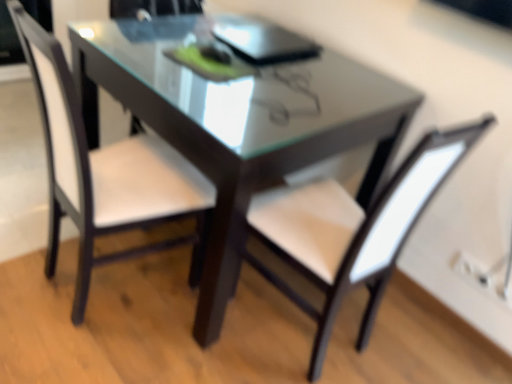
What do you see at coordinates (239, 125) in the screenshot?
I see `transparent glass table at center` at bounding box center [239, 125].

Identify the location of transparent glass table at center. The image size is (512, 384). (239, 125).

Between transparent glass table at center and white leather chair at center, marked as the first chair in a right-to-left arrangement, which one is positioned in front?

white leather chair at center, marked as the first chair in a right-to-left arrangement, is closer to the camera.

Based on the photo, is transparent glass table at center not within white leather chair at center, marked as the first chair in a right-to-left arrangement?

Indeed, transparent glass table at center is completely outside white leather chair at center, marked as the first chair in a right-to-left arrangement.

In terms of width, does transparent glass table at center look wider or thinner when compared to white leather chair at center, marked as the first chair in a right-to-left arrangement?

In the image, transparent glass table at center appears to be wider than white leather chair at center, marked as the first chair in a right-to-left arrangement.

From a real-world perspective, who is located lower, transparent glass table at center or white leather chair at center, marked as the first chair in a right-to-left arrangement?

transparent glass table at center is physically lower.

Is white leather chair at center, marked as the first chair in a right-to-left arrangement, beside transparent glass table at center?

No, white leather chair at center, marked as the first chair in a right-to-left arrangement, is not touching transparent glass table at center.

In the scene shown: Is white leather chair at center, marked as the 2th chair in a left-to-right arrangement, bigger or smaller than transparent glass table at center?

Clearly, white leather chair at center, marked as the 2th chair in a left-to-right arrangement, is smaller in size than transparent glass table at center.

Is point (390, 231) closer to camera compared to point (271, 176)?

No, (390, 231) is behind (271, 176).

How many degrees apart are the facing directions of white leather chair at center, marked as the first chair in a right-to-left arrangement, and transparent glass table at center?

The angle between the facing direction of white leather chair at center, marked as the first chair in a right-to-left arrangement, and the facing direction of transparent glass table at center is 97.2 degrees.

Could you tell me if transparent glass table at center is facing white leather chair at center, the second chair from the right?

Yes, transparent glass table at center faces towards white leather chair at center, the second chair from the right.

Relative to white leather chair at center, the second chair from the right, is transparent glass table at center in front or behind?

Clearly, transparent glass table at center is behind white leather chair at center, the second chair from the right.

In the scene shown: Is transparent glass table at center spatially inside white leather chair at center, marked as the 1th chair in a left-to-right arrangement, or outside of it?

The correct answer is: outside.

Can you confirm if transparent glass table at center is smaller than white leather chair at center, marked as the 1th chair in a left-to-right arrangement?

No, transparent glass table at center is not smaller than white leather chair at center, marked as the 1th chair in a left-to-right arrangement.

In the scene shown: Is white leather chair at center, marked as the 1th chair in a left-to-right arrangement, in front of white leather chair at center, marked as the 2th chair in a left-to-right arrangement?

No, it is not.

Locate an element on the screen. chair above the white leather chair at center, marked as the first chair in a right-to-left arrangement (from a real-world perspective) is located at coordinates (105, 172).

Does white leather chair at center, the second chair from the right, appear on the right side of white leather chair at center, marked as the 2th chair in a left-to-right arrangement?

In fact, white leather chair at center, the second chair from the right, is to the left of white leather chair at center, marked as the 2th chair in a left-to-right arrangement.

Measure the distance from white leather chair at center, the second chair from the right, to white leather chair at center, marked as the 2th chair in a left-to-right arrangement.

A distance of 18.55 inches exists between white leather chair at center, the second chair from the right, and white leather chair at center, marked as the 2th chair in a left-to-right arrangement.

Based on their sizes in the image, would you say white leather chair at center, marked as the first chair in a right-to-left arrangement, is bigger or smaller than white leather chair at center, the second chair from the right?

In the image, white leather chair at center, marked as the first chair in a right-to-left arrangement, appears to be larger than white leather chair at center, the second chair from the right.

Does point (289, 294) appear closer or farther from the camera than point (32, 40)?

Point (289, 294).

From a real-world perspective, relative to white leather chair at center, marked as the 1th chair in a left-to-right arrangement, is white leather chair at center, marked as the first chair in a right-to-left arrangement, vertically above or below?

From a real-world perspective, white leather chair at center, marked as the first chair in a right-to-left arrangement, is physically below white leather chair at center, marked as the 1th chair in a left-to-right arrangement.

Can you tell me how much white leather chair at center, marked as the first chair in a right-to-left arrangement, and white leather chair at center, marked as the 1th chair in a left-to-right arrangement, differ in facing direction?

The angle between the facing direction of white leather chair at center, marked as the first chair in a right-to-left arrangement, and the facing direction of white leather chair at center, marked as the 1th chair in a left-to-right arrangement, is 85.9 degrees.

From the picture: Is transparent glass table at center at the back of white leather chair at center, marked as the 1th chair in a left-to-right arrangement?

Correct, white leather chair at center, marked as the 1th chair in a left-to-right arrangement, is looking away from transparent glass table at center.

In the image, is white leather chair at center, marked as the 1th chair in a left-to-right arrangement, on the left side or the right side of transparent glass table at center?

Clearly, white leather chair at center, marked as the 1th chair in a left-to-right arrangement, is on the left of transparent glass table at center in the image.

Considering the sizes of objects white leather chair at center, the second chair from the right, and transparent glass table at center in the image provided, who is smaller, white leather chair at center, the second chair from the right, or transparent glass table at center?

white leather chair at center, the second chair from the right, is smaller.

Is the position of white leather chair at center, marked as the 1th chair in a left-to-right arrangement, less distant than that of transparent glass table at center?

Yes, white leather chair at center, marked as the 1th chair in a left-to-right arrangement, is in front of transparent glass table at center.

From the image's perspective, count 2nd chairs downward from the transparent glass table at center and point to it. Please provide its 2D coordinates.

[(351, 230)]

The height and width of the screenshot is (384, 512). In order to click on the 2nd chair in front of the transparent glass table at center, starting your count from the anchor in this screenshot , I will do `click(351, 230)`.

Looking at the image, which one is located further to transparent glass table at center, white leather chair at center, marked as the first chair in a right-to-left arrangement, or white leather chair at center, the second chair from the right?

white leather chair at center, marked as the first chair in a right-to-left arrangement.

Estimate the real-world distances between objects in this image. Which object is closer to white leather chair at center, marked as the 1th chair in a left-to-right arrangement, transparent glass table at center or white leather chair at center, marked as the first chair in a right-to-left arrangement?

The object closer to white leather chair at center, marked as the 1th chair in a left-to-right arrangement, is transparent glass table at center.

Looking at the image, which one is located further to white leather chair at center, marked as the 2th chair in a left-to-right arrangement, transparent glass table at center or white leather chair at center, marked as the 1th chair in a left-to-right arrangement?

white leather chair at center, marked as the 1th chair in a left-to-right arrangement, lies further to white leather chair at center, marked as the 2th chair in a left-to-right arrangement, than the other object.

Estimate the real-world distances between objects in this image. Which object is further from white leather chair at center, marked as the first chair in a right-to-left arrangement, white leather chair at center, the second chair from the right, or transparent glass table at center?

white leather chair at center, the second chair from the right, is positioned further to the anchor white leather chair at center, marked as the first chair in a right-to-left arrangement.

Based on their spatial positions, is white leather chair at center, marked as the 2th chair in a left-to-right arrangement, or transparent glass table at center further from white leather chair at center, the second chair from the right?

white leather chair at center, marked as the 2th chair in a left-to-right arrangement, lies further to white leather chair at center, the second chair from the right, than the other object.

Considering their positions, is white leather chair at center, the second chair from the right, positioned further to transparent glass table at center than white leather chair at center, marked as the 2th chair in a left-to-right arrangement?

white leather chair at center, marked as the 2th chair in a left-to-right arrangement.

Where is `table between white leather chair at center, marked as the 1th chair in a left-to-right arrangement, and white leather chair at center, marked as the first chair in a right-to-left arrangement, in the horizontal direction`? Image resolution: width=512 pixels, height=384 pixels. table between white leather chair at center, marked as the 1th chair in a left-to-right arrangement, and white leather chair at center, marked as the first chair in a right-to-left arrangement, in the horizontal direction is located at coordinates (239, 125).